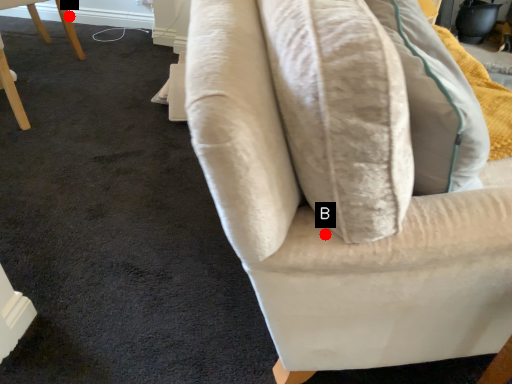
Question: Two points are circled on the image, labeled by A and B beside each circle. Which point appears farthest from the camera in this image?

Choices:
 (A) A is further
 (B) B is further

Answer: (A)